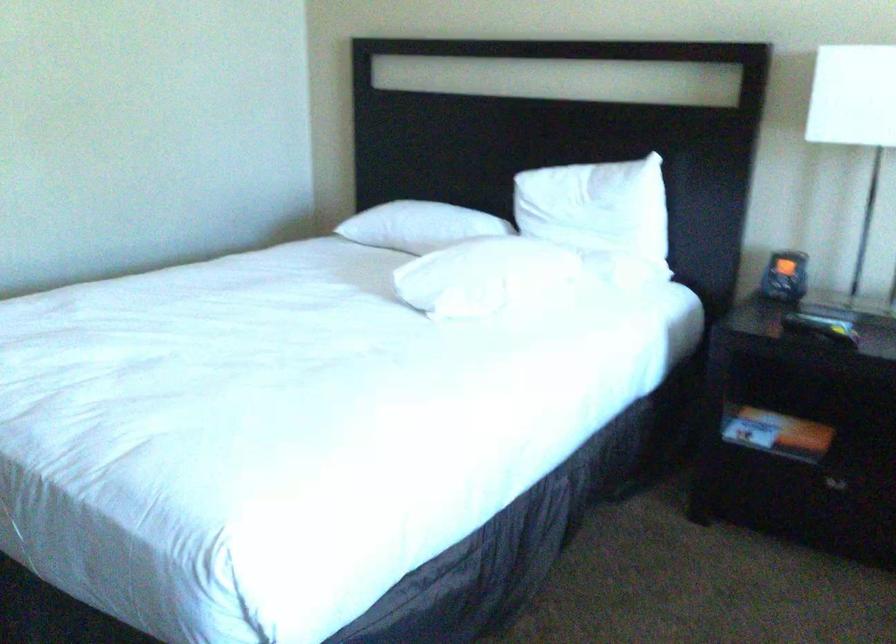
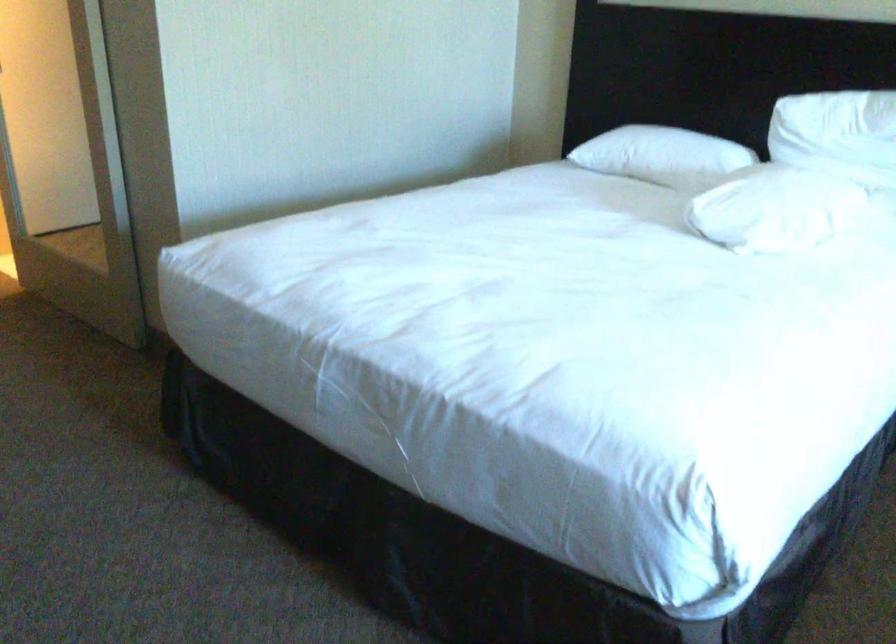
Question: In a continuous first-person perspective shot, in which direction is the camera moving?

Choices:
 (A) Left
 (B) Right
 (C) Forward
 (D) Backward

Answer: (A)